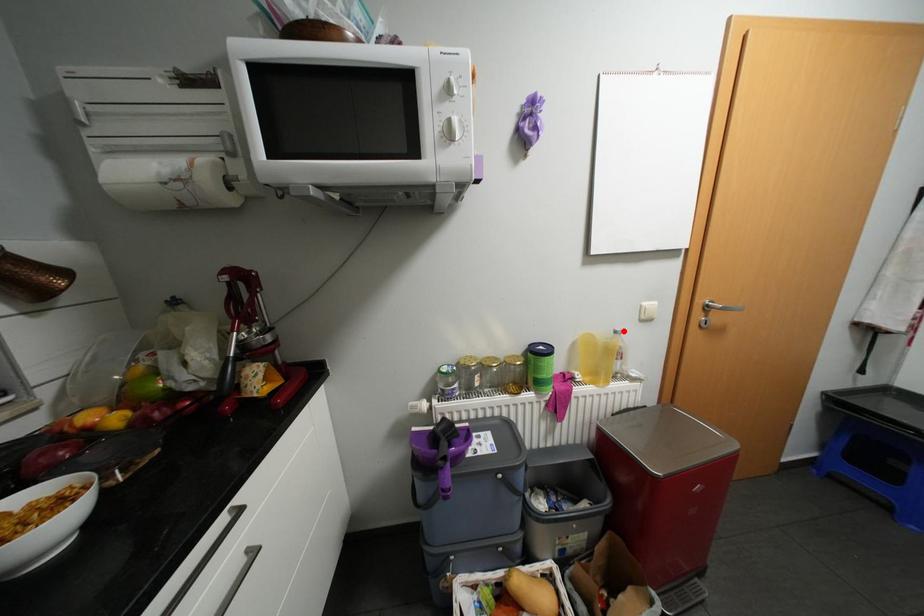
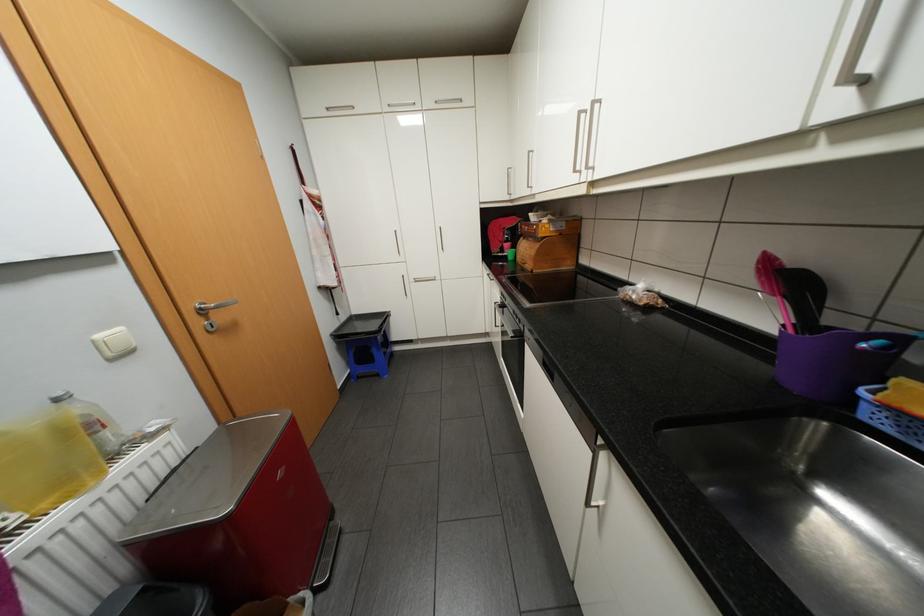
Find the pixel in the second image that matches the highlighted location in the first image.

(65, 399)